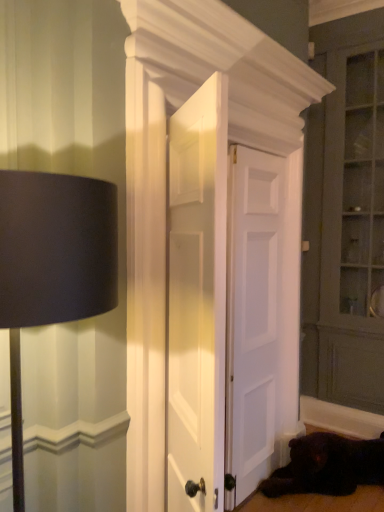
The image size is (384, 512). What do you see at coordinates (327, 466) in the screenshot? I see `shiny black fur at lower right` at bounding box center [327, 466].

What do you see at coordinates (345, 231) in the screenshot?
I see `matte gray dresser at right` at bounding box center [345, 231].

Describe the element at coordinates (197, 298) in the screenshot. I see `white wooden door at center, which ranks as the 3th door in back-to-front order` at that location.

Identify the location of white wooden door at center, arranged as the first door when viewed from the front. (197, 298).

Find the location of a particular element. white painted wood door at center, placed as the 2th door when sorted from front to back is located at coordinates (229, 305).

What's the angular difference between white wooden door at center, arranged as the first door when viewed from the front, and matte gray dresser at right's facing directions?

The angular difference between white wooden door at center, arranged as the first door when viewed from the front, and matte gray dresser at right is 143 degrees.

Looking at this image, considering the sizes of objects white wooden door at center, arranged as the first door when viewed from the front, and matte gray dresser at right in the image provided, who is thinner, white wooden door at center, arranged as the first door when viewed from the front, or matte gray dresser at right?

Thinner between the two is white wooden door at center, arranged as the first door when viewed from the front.

Between white wooden door at center, which ranks as the 3th door in back-to-front order, and matte gray dresser at right, which one has more height?

Standing taller between the two is matte gray dresser at right.

Would you say matte gray dresser at right is part of white wooden door at center, arranged as the first door when viewed from the front,'s contents?

No, matte gray dresser at right is not inside white wooden door at center, arranged as the first door when viewed from the front.

What's the angular difference between white wooden door at center, which ranks as the 3th door in back-to-front order, and white matte door at center, which is the first door from back to front,'s facing directions?

white wooden door at center, which ranks as the 3th door in back-to-front order, and white matte door at center, which is the first door from back to front, are facing 54.1 degrees away from each other.

From a real-world perspective, count 2nd doors downward from the white wooden door at center, which ranks as the 3th door in back-to-front order, and point to it. Please provide its 2D coordinates.

[(253, 319)]

Can you confirm if white wooden door at center, which ranks as the 3th door in back-to-front order, is shorter than white matte door at center, the 3th door in the front-to-back sequence?

Correct, white wooden door at center, which ranks as the 3th door in back-to-front order, is not as tall as white matte door at center, the 3th door in the front-to-back sequence.

From the image's perspective, is white wooden door at center, arranged as the first door when viewed from the front, beneath white matte door at center, which is the first door from back to front?

No, from the image's perspective, white wooden door at center, arranged as the first door when viewed from the front, is not below white matte door at center, which is the first door from back to front.

Is shiny black fur at lower right positioned before black matte lampshade at left?

No, shiny black fur at lower right is further to the viewer.

Is there a large distance between shiny black fur at lower right and black matte lampshade at left?

shiny black fur at lower right is far away from black matte lampshade at left.

Looking at their sizes, would you say shiny black fur at lower right is wider or thinner than black matte lampshade at left?

In the image, shiny black fur at lower right appears to be wider than black matte lampshade at left.

Is shiny black fur at lower right facing towards black matte lampshade at left?

No, shiny black fur at lower right is not aimed at black matte lampshade at left.

What's the angular difference between white wooden door at center, which ranks as the 3th door in back-to-front order, and white painted wood door at center, placed as the 2th door when sorted from front to back,'s facing directions?

white wooden door at center, which ranks as the 3th door in back-to-front order, and white painted wood door at center, placed as the 2th door when sorted from front to back, are facing 54.1 degrees away from each other.

Considering the positions of objects white wooden door at center, arranged as the first door when viewed from the front, and white painted wood door at center, placed as the 2th door when sorted from front to back, in the image provided, who is behind, white wooden door at center, arranged as the first door when viewed from the front, or white painted wood door at center, placed as the 2th door when sorted from front to back,?

white painted wood door at center, placed as the 2th door when sorted from front to back.

Is point (187, 416) positioned after point (171, 409)?

No.

From the image's perspective, is white wooden door at center, which ranks as the 3th door in back-to-front order, below white painted wood door at center, placed as the 2th door when sorted from front to back?

No, from the image's perspective, white wooden door at center, which ranks as the 3th door in back-to-front order, is not below white painted wood door at center, placed as the 2th door when sorted from front to back.

From a real-world perspective, which is physically below, white matte door at center, the 3th door in the front-to-back sequence, or black matte lampshade at left?

white matte door at center, the 3th door in the front-to-back sequence, from a real-world perspective.

Is there a large distance between white matte door at center, the 3th door in the front-to-back sequence, and black matte lampshade at left?

Yes, white matte door at center, the 3th door in the front-to-back sequence, and black matte lampshade at left are located far from each other.

Where is `table lamp located above the white matte door at center, the 3th door in the front-to-back sequence (from the image's perspective)`? table lamp located above the white matte door at center, the 3th door in the front-to-back sequence (from the image's perspective) is located at coordinates (52, 266).

Is white matte door at center, which is the first door from back to front, situated inside black matte lampshade at left or outside?

white matte door at center, which is the first door from back to front, is not inside black matte lampshade at left, it's outside.

Considering the relative positions of black matte lampshade at left and shiny black fur at lower right in the image provided, is black matte lampshade at left to the left of shiny black fur at lower right from the viewer's perspective?

Correct, you'll find black matte lampshade at left to the left of shiny black fur at lower right.

Identify the location of dog on the right of black matte lampshade at left. (327, 466).

From the picture: From a real-world perspective, is black matte lampshade at left above or below shiny black fur at lower right?

In terms of real-world spatial position, black matte lampshade at left is above shiny black fur at lower right.

From the image's perspective, which is above, black matte lampshade at left or shiny black fur at lower right?

black matte lampshade at left, from the image's perspective.

Which is closer, (232, 335) or (362, 469)?

The point (232, 335) is in front.

Is white matte door at center, which is the first door from back to front, smaller than shiny black fur at lower right?

Actually, white matte door at center, which is the first door from back to front, might be larger than shiny black fur at lower right.

From a real-world perspective, is white matte door at center, which is the first door from back to front, positioned over shiny black fur at lower right based on gravity?

Yes, from a real-world perspective, white matte door at center, which is the first door from back to front, is above shiny black fur at lower right.

Is the depth of white matte door at center, which is the first door from back to front, greater than that of shiny black fur at lower right?

Yes, the depth of white matte door at center, which is the first door from back to front, is greater than that of shiny black fur at lower right.

Locate an element on the screen. The width and height of the screenshot is (384, 512). the 3rd door in front when counting from the matte gray dresser at right is located at coordinates (197, 298).

Locate an element on the screen. This screenshot has width=384, height=512. the 2nd door to the right of the white wooden door at center, which ranks as the 3th door in back-to-front order, counting from the anchor's position is located at coordinates (253, 319).

When comparing their distances from shiny black fur at lower right, does white wooden door at center, arranged as the first door when viewed from the front, or white painted wood door at center, the 2th door from the back, seem further?

white wooden door at center, arranged as the first door when viewed from the front.

Looking at the image, which one is located further to white wooden door at center, which ranks as the 3th door in back-to-front order, white painted wood door at center, placed as the 2th door when sorted from front to back, or black matte lampshade at left?

white painted wood door at center, placed as the 2th door when sorted from front to back, is further to white wooden door at center, which ranks as the 3th door in back-to-front order.

Estimate the real-world distances between objects in this image. Which object is closer to matte gray dresser at right, white wooden door at center, which ranks as the 3th door in back-to-front order, or black matte lampshade at left?

Based on the image, white wooden door at center, which ranks as the 3th door in back-to-front order, appears to be nearer to matte gray dresser at right.

Based on their spatial positions, is matte gray dresser at right or shiny black fur at lower right further from black matte lampshade at left?

matte gray dresser at right lies further to black matte lampshade at left than the other object.

Considering their positions, is shiny black fur at lower right positioned further to matte gray dresser at right than white painted wood door at center, the 2th door from the back?

shiny black fur at lower right is positioned further to the anchor matte gray dresser at right.

Estimate the real-world distances between objects in this image. Which object is closer to white painted wood door at center, placed as the 2th door when sorted from front to back, matte gray dresser at right or black matte lampshade at left?

Based on the image, matte gray dresser at right appears to be nearer to white painted wood door at center, placed as the 2th door when sorted from front to back.

From the image, which object appears to be nearer to white matte door at center, the 3th door in the front-to-back sequence, white painted wood door at center, placed as the 2th door when sorted from front to back, or white wooden door at center, which ranks as the 3th door in back-to-front order?

white painted wood door at center, placed as the 2th door when sorted from front to back, is positioned closer to the anchor white matte door at center, the 3th door in the front-to-back sequence.

Considering their positions, is black matte lampshade at left positioned further to white wooden door at center, arranged as the first door when viewed from the front, than white painted wood door at center, the 2th door from the back?

white painted wood door at center, the 2th door from the back.

Locate an element on the screen. dog between black matte lampshade at left and white matte door at center, which is the first door from back to front, from front to back is located at coordinates (327, 466).

Locate an element on the screen. This screenshot has height=512, width=384. door positioned between black matte lampshade at left and white painted wood door at center, the 2th door from the back, from near to far is located at coordinates (197, 298).

What are the coordinates of `door between white painted wood door at center, the 2th door from the back, and shiny black fur at lower right, in the vertical direction` in the screenshot? It's located at (253, 319).

Image resolution: width=384 pixels, height=512 pixels. I want to click on door between white painted wood door at center, placed as the 2th door when sorted from front to back, and matte gray dresser at right from front to back, so click(253, 319).